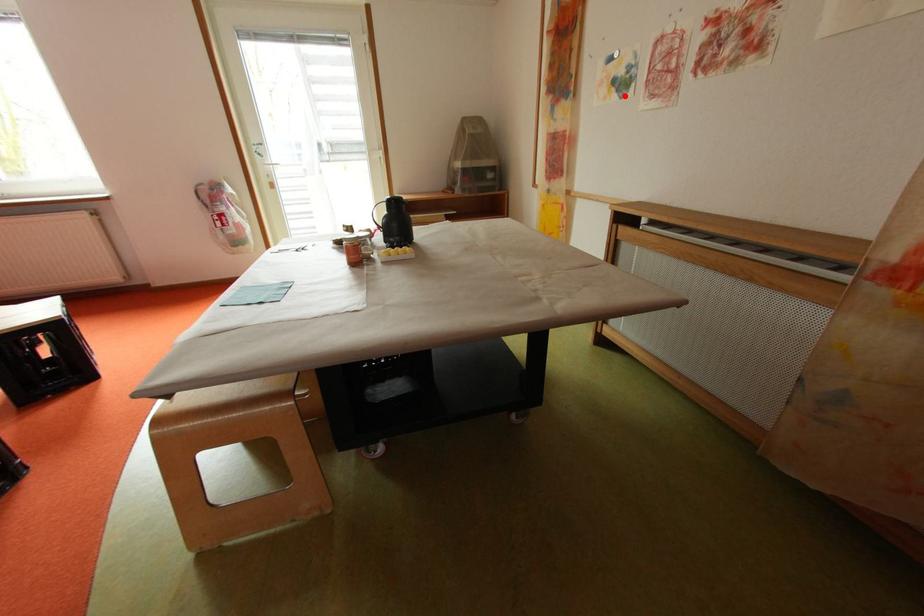
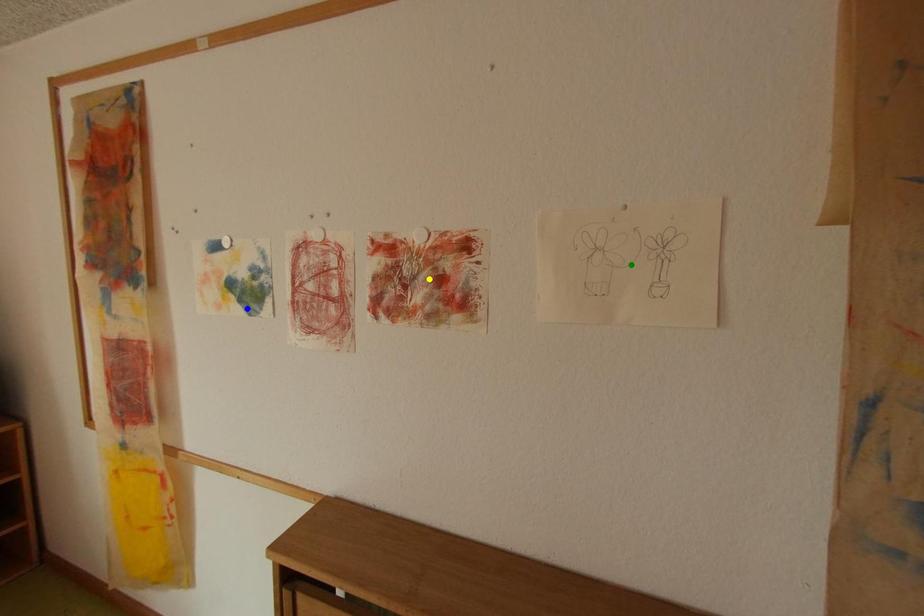
Question: I am providing you with two images of the same scene from different viewpoints. A red point is marked on the first image. You are given multiple points on the second image. Which point in image 2 represents the same 3d spot as the red point in image 1?

Choices:
 (A) blue point
 (B) green point
 (C) yellow point

Answer: (A)